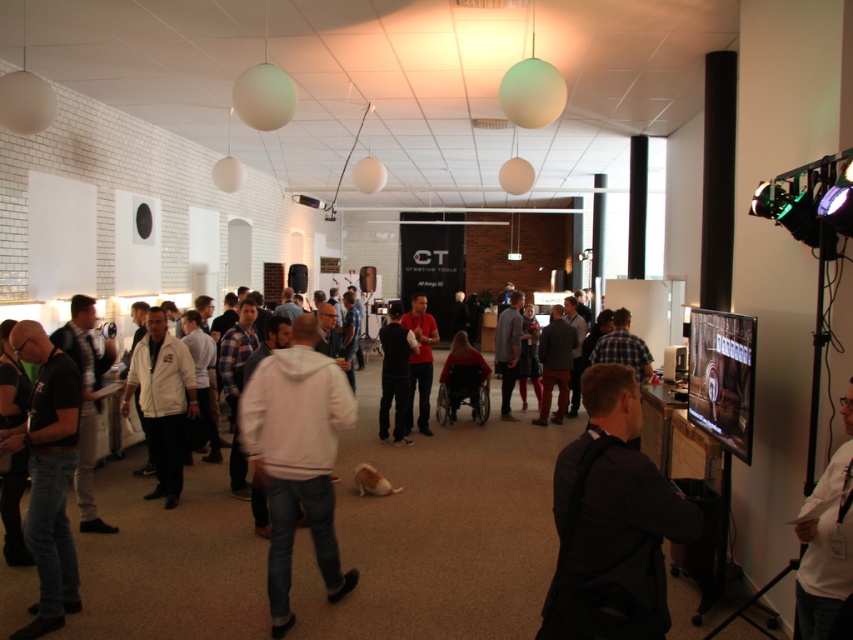
Question: Which object is closer to the camera taking this photo?

Choices:
 (A) black matte t-shirt at center
 (B) red matte shirt at center
 (C) white matte jacket at center
 (D) white fabric shirt at lower right

Answer: (D)

Question: Which is farther from the red matte shirt at center?

Choices:
 (A) black matte t-shirt at center
 (B) white fabric shirt at lower right
 (C) dark gray sweater at center

Answer: (B)

Question: Does dark gray hoodie at center lie behind red matte shirt at center?

Choices:
 (A) no
 (B) yes

Answer: (A)

Question: Does black leather jacket at lower right appear on the left side of white fleece jacket at center?

Choices:
 (A) no
 (B) yes

Answer: (A)

Question: Observing the image, what is the correct spatial positioning of black leather jacket at lower right in reference to white fabric shirt at lower right?

Choices:
 (A) left
 (B) right

Answer: (A)

Question: Which point appears farthest from the camera in this image?

Choices:
 (A) (430, 365)
 (B) (851, 422)
 (C) (396, 342)
 (D) (276, 596)

Answer: (A)